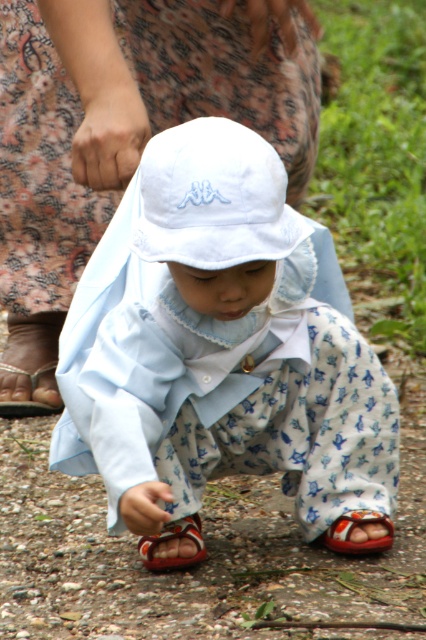
Is point (173, 524) positioned in front of point (29, 410)?

Yes, it is.

Does reddish-brown fabric sandal at lower center appear on the left side of brown leather sandal at lower left?

In fact, reddish-brown fabric sandal at lower center is to the right of brown leather sandal at lower left.

Is point (181, 532) closer to viewer compared to point (11, 413)?

Yes.

Locate an element on the screen. This screenshot has width=426, height=640. reddish-brown fabric sandal at lower center is located at coordinates (170, 540).

Can you confirm if white fabric hat at center is smaller than brown leather sandal at lower left?

No, white fabric hat at center is not smaller than brown leather sandal at lower left.

Can you confirm if white fabric hat at center is thinner than brown leather sandal at lower left?

In fact, white fabric hat at center might be wider than brown leather sandal at lower left.

Is point (230, 124) positioned before point (36, 378)?

Yes, point (230, 124) is closer to viewer.

Locate an element on the screen. The image size is (426, 640). white fabric hat at center is located at coordinates (213, 196).

Between white cotton hat at center and reddish-brown fabric sandal at lower center, which one appears on the left side from the viewer's perspective?

Positioned to the left is reddish-brown fabric sandal at lower center.

Between point (317, 384) and point (155, 557), which one is positioned in front?

Point (317, 384)

I want to click on white cotton hat at center, so click(218, 346).

The width and height of the screenshot is (426, 640). What are the coordinates of `white cotton hat at center` in the screenshot? It's located at (218, 346).